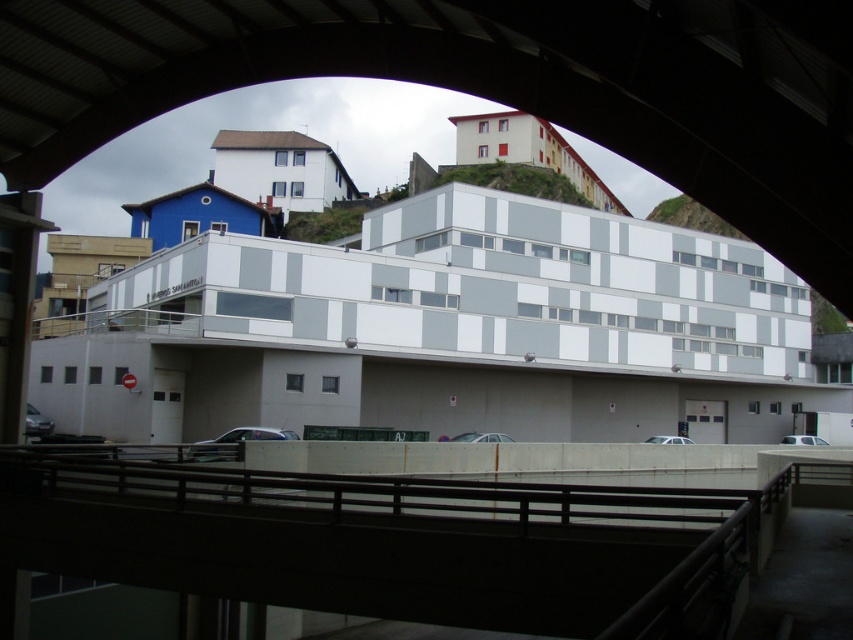
This screenshot has width=853, height=640. Describe the element at coordinates (486, 86) in the screenshot. I see `white matte building at center` at that location.

Is white matte building at center to the left of black metal rail at center from the viewer's perspective?

A: Correct, you'll find white matte building at center to the left of black metal rail at center.

Measure the distance between white matte building at center and camera.

white matte building at center and camera are 20.84 feet apart from each other.

The image size is (853, 640). I want to click on white matte building at center, so click(x=486, y=86).

Can you confirm if white concrete parking garage at center is positioned to the right of black metal rail at center?

Indeed, white concrete parking garage at center is positioned on the right side of black metal rail at center.

Who is lower down, white concrete parking garage at center or black metal rail at center?

black metal rail at center is lower down.

Where is `white concrete parking garage at center`? This screenshot has height=640, width=853. white concrete parking garage at center is located at coordinates (445, 332).

Which is above, white concrete parking garage at center or white matte building at center?

white matte building at center is higher up.

Between white concrete parking garage at center and white matte building at center, which one has less height?

With less height is white matte building at center.

Who is more forward, (711, 337) or (485, 42)?

Point (485, 42) is more forward.

I want to click on white concrete parking garage at center, so click(445, 332).